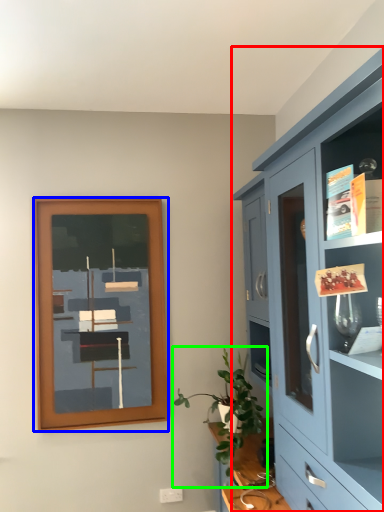
Question: Which is nearer to the cabinetry (highlighted by a red box)? picture frame (highlighted by a blue box) or houseplant (highlighted by a green box).

Choices:
 (A) picture frame
 (B) houseplant

Answer: (B)